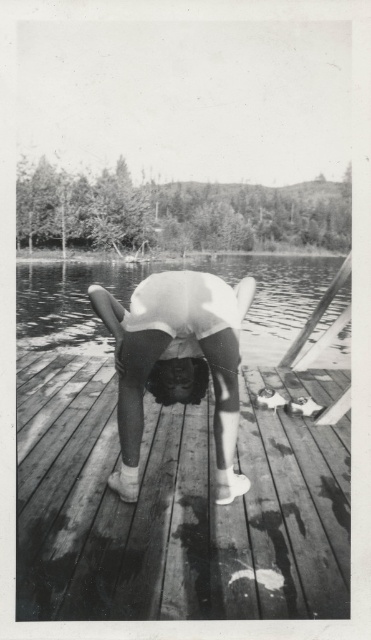
Is white matte shorts at center below transparent water at center?

Correct, white matte shorts at center is located below transparent water at center.

Can you confirm if white matte shorts at center is bigger than transparent water at center?

No, white matte shorts at center is not bigger than transparent water at center.

Is point (231, 289) farther from camera compared to point (83, 332)?

No, it is not.

Locate an element on the screen. white matte shorts at center is located at coordinates (176, 362).

Which is below, wooden at center or white matte shorts at center?

Positioned lower is wooden at center.

Is wooden at center smaller than white matte shorts at center?

No.

What do you see at coordinates (176, 504) in the screenshot? The width and height of the screenshot is (371, 640). I see `wooden at center` at bounding box center [176, 504].

You are a GUI agent. You are given a task and a screenshot of the screen. Output one action in this format:
    pyautogui.click(x=<x>, y=<y>)
    Task: Click on the wooden at center
    
    Given the screenshot: What is the action you would take?
    pyautogui.click(x=176, y=504)

Which is more to the left, wooden at center or transparent water at center?

Positioned to the left is transparent water at center.

Is the position of wooden at center more distant than that of transparent water at center?

No, it is not.

Is point (112, 524) farther from camera compared to point (47, 288)?

That is False.

The image size is (371, 640). In order to click on wooden at center in this screenshot , I will do `click(176, 504)`.